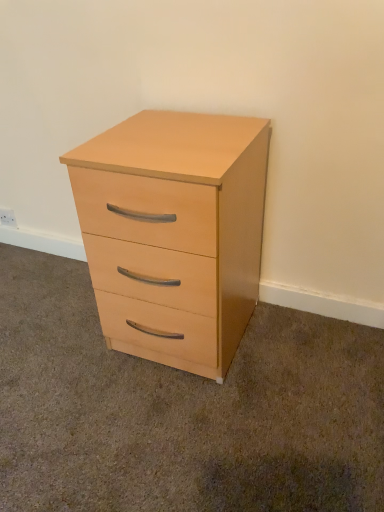
The image size is (384, 512). What do you see at coordinates (8, 217) in the screenshot? I see `white plastic electric outlet at lower left` at bounding box center [8, 217].

At what (x,y) coordinates should I click in order to perform the action: click on white plastic electric outlet at lower left. Please return your answer as a coordinate pair (x, y). This screenshot has width=384, height=512. Looking at the image, I should click on (8, 217).

At what (x,y) coordinates should I click in order to perform the action: click on light wood/finish chest of drawers at center. Please return your answer as a coordinate pair (x, y). The height and width of the screenshot is (512, 384). Looking at the image, I should click on (174, 233).

This screenshot has width=384, height=512. What do you see at coordinates (174, 233) in the screenshot?
I see `light wood/finish chest of drawers at center` at bounding box center [174, 233].

At what (x,y) coordinates should I click in order to perform the action: click on white plastic electric outlet at lower left. Please return your answer as a coordinate pair (x, y). Looking at the image, I should click on (8, 217).

Between light wood/finish chest of drawers at center and white plastic electric outlet at lower left, which one appears on the left side from the viewer's perspective?

white plastic electric outlet at lower left.

Which object is further away from the camera taking this photo, light wood/finish chest of drawers at center or white plastic electric outlet at lower left?

Positioned behind is white plastic electric outlet at lower left.

Is point (200, 330) farther from camera compared to point (12, 219)?

No, it is not.

In the scene shown: From the image's perspective, between light wood/finish chest of drawers at center and white plastic electric outlet at lower left, who is located below?

From the image's view, light wood/finish chest of drawers at center is below.

From a real-world perspective, relative to white plastic electric outlet at lower left, is light wood/finish chest of drawers at center vertically above or below?

In terms of real-world spatial position, light wood/finish chest of drawers at center is above white plastic electric outlet at lower left.

Considering the relative sizes of light wood/finish chest of drawers at center and white plastic electric outlet at lower left in the image provided, is light wood/finish chest of drawers at center wider than white plastic electric outlet at lower left?

Yes.

Which of these two, light wood/finish chest of drawers at center or white plastic electric outlet at lower left, stands taller?

With more height is light wood/finish chest of drawers at center.

Is light wood/finish chest of drawers at center bigger or smaller than white plastic electric outlet at lower left?

light wood/finish chest of drawers at center is bigger than white plastic electric outlet at lower left.

Do you think light wood/finish chest of drawers at center is within white plastic electric outlet at lower left, or outside of it?

light wood/finish chest of drawers at center cannot be found inside white plastic electric outlet at lower left.

Would you consider light wood/finish chest of drawers at center to be distant from white plastic electric outlet at lower left?

light wood/finish chest of drawers at center is positioned a significant distance from white plastic electric outlet at lower left.

Is light wood/finish chest of drawers at center oriented away from white plastic electric outlet at lower left?

No, light wood/finish chest of drawers at center is not facing the opposite direction of white plastic electric outlet at lower left.

How different are the orientations of light wood/finish chest of drawers at center and white plastic electric outlet at lower left in degrees?

They differ by 1.36 degrees in their facing directions.

You are a GUI agent. You are given a task and a screenshot of the screen. Output one action in this format:
    pyautogui.click(x=<x>, y=<y>)
    Task: Click on the chest of drawers above the white plastic electric outlet at lower left (from a real-world perspective)
    This screenshot has width=384, height=512.
    Given the screenshot: What is the action you would take?
    pyautogui.click(x=174, y=233)

Between white plastic electric outlet at lower left and light wood/finish chest of drawers at center, which one appears on the left side from the viewer's perspective?

white plastic electric outlet at lower left is more to the left.

Is white plastic electric outlet at lower left in front of light wood/finish chest of drawers at center?

No, white plastic electric outlet at lower left is further to the viewer.

Considering the points (14, 218) and (187, 325), which point is in front, point (14, 218) or point (187, 325)?

The point (187, 325) is more forward.

From the image's perspective, is white plastic electric outlet at lower left located above or below light wood/finish chest of drawers at center?

Based on their image positions, white plastic electric outlet at lower left is located above light wood/finish chest of drawers at center.

From a real-world perspective, is white plastic electric outlet at lower left physically above light wood/finish chest of drawers at center?

Actually, white plastic electric outlet at lower left is physically below light wood/finish chest of drawers at center in the real world.

Which of these two, white plastic electric outlet at lower left or light wood/finish chest of drawers at center, is wider?

light wood/finish chest of drawers at center.

Is white plastic electric outlet at lower left shorter than light wood/finish chest of drawers at center?

Correct, white plastic electric outlet at lower left is not as tall as light wood/finish chest of drawers at center.

Between white plastic electric outlet at lower left and light wood/finish chest of drawers at center, which one has smaller size?

white plastic electric outlet at lower left.

Choose the correct answer: Is white plastic electric outlet at lower left inside light wood/finish chest of drawers at center or outside it?

white plastic electric outlet at lower left is spatially situated outside light wood/finish chest of drawers at center.

Is white plastic electric outlet at lower left placed right next to light wood/finish chest of drawers at center?

white plastic electric outlet at lower left and light wood/finish chest of drawers at center are clearly separated.

Is white plastic electric outlet at lower left positioned with its back to light wood/finish chest of drawers at center?

No, white plastic electric outlet at lower left is not facing away from light wood/finish chest of drawers at center.

How different are the orientations of white plastic electric outlet at lower left and light wood/finish chest of drawers at center in degrees?

The angular difference between white plastic electric outlet at lower left and light wood/finish chest of drawers at center is 1.36 degrees.

What are the coordinates of `the chest of drawers that is in front of the white plastic electric outlet at lower left` in the screenshot? It's located at (174, 233).

The width and height of the screenshot is (384, 512). Identify the location of electric outlet behind the light wood/finish chest of drawers at center. tap(8, 217).

Where is `electric outlet that is under the light wood/finish chest of drawers at center (from a real-world perspective)`? The image size is (384, 512). electric outlet that is under the light wood/finish chest of drawers at center (from a real-world perspective) is located at coordinates (8, 217).